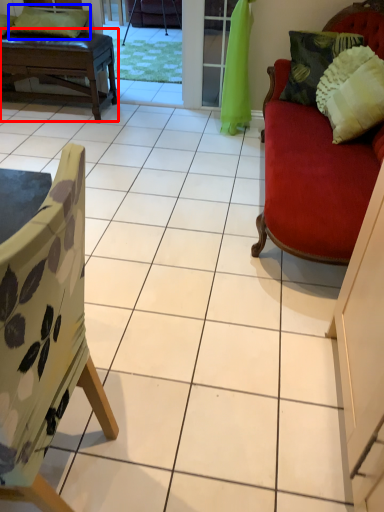
Question: Among these objects, which one is nearest to the camera, table (highlighted by a red box) or pillow (highlighted by a blue box)?

Choices:
 (A) table
 (B) pillow

Answer: (A)